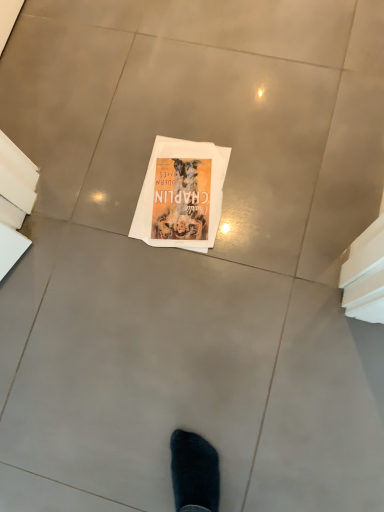
Question: Should I look upward or downward to see matte paper book at center?

Choices:
 (A) up
 (B) down

Answer: (A)